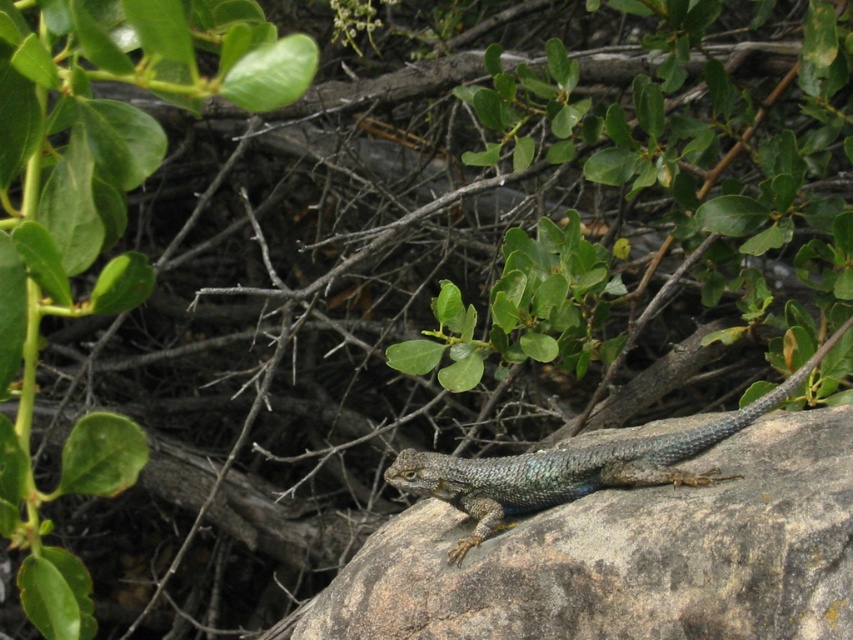
Image resolution: width=853 pixels, height=640 pixels. Describe the element at coordinates (628, 556) in the screenshot. I see `rough textured rock at center` at that location.

Is point (483, 564) in front of point (35, 506)?

No, it is behind (35, 506).

Which is in front, point (625, 612) or point (85, 456)?

Point (85, 456)

You are a GUI agent. You are given a task and a screenshot of the screen. Output one action in this format:
    pyautogui.click(x=<x>, y=<y>)
    Task: Click on the rough textured rock at center
    This screenshot has width=853, height=640.
    Given the screenshot: What is the action you would take?
    pyautogui.click(x=628, y=556)

Who is more forward, [728,440] or [633,483]?

Positioned in front is point [633,483].

Locate an element on the screen. rough textured rock at center is located at coordinates (628, 556).

Who is more distant from viewer, (120, 298) or (656, 452)?

Point (656, 452)

Is green leafy plant at upper left below shiny blue lizard at center?

Incorrect, green leafy plant at upper left is not positioned below shiny blue lizard at center.

Identify the location of green leafy plant at upper left. (96, 220).

What are the coordinates of `green leafy plant at upper left` in the screenshot? It's located at point(96,220).